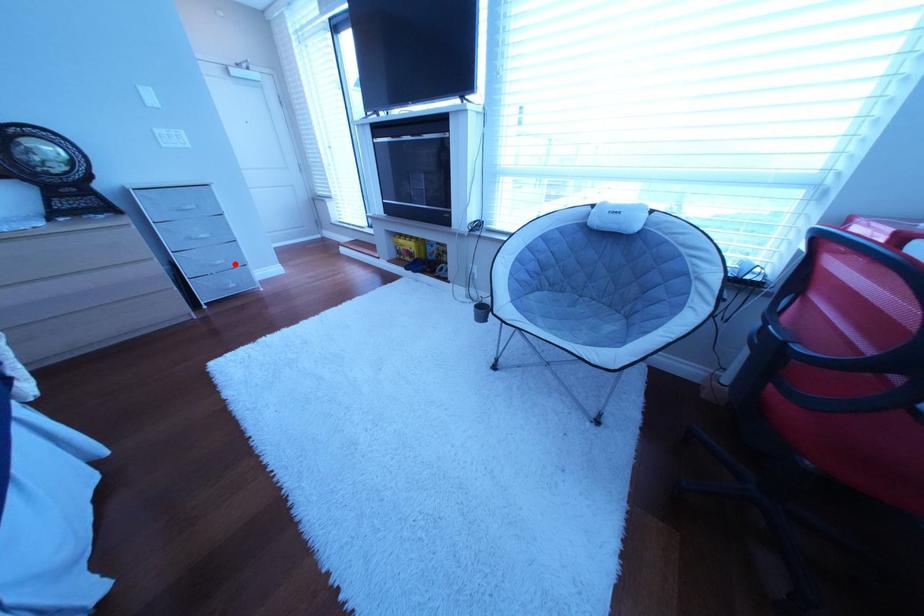
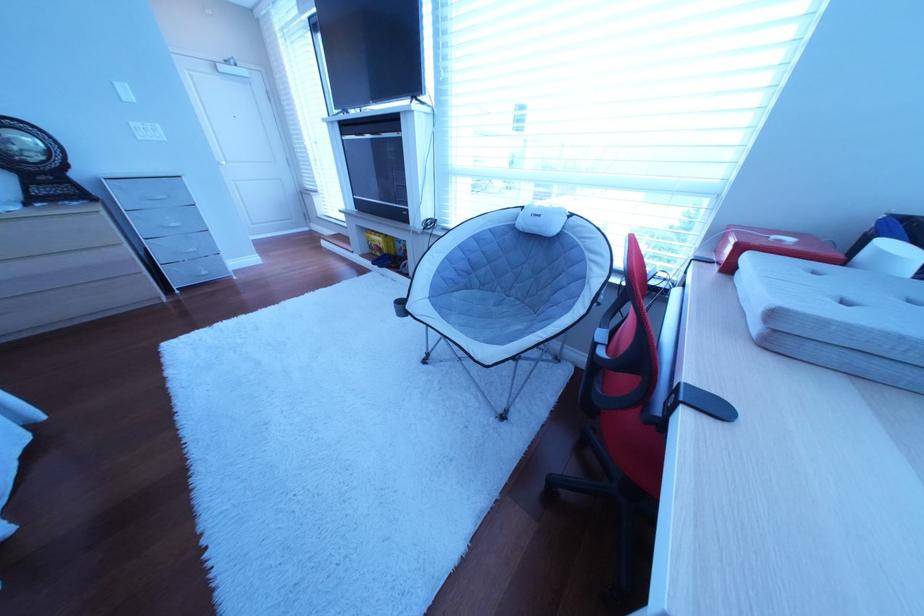
Question: A red point is marked in image1. In image2, is the corresponding 3D point closer to the camera or farther? Reply with the corresponding letter.

Choices:
 (A) The corresponding 3D point is closer.
 (B) The corresponding 3D point is farther.

Answer: (A)